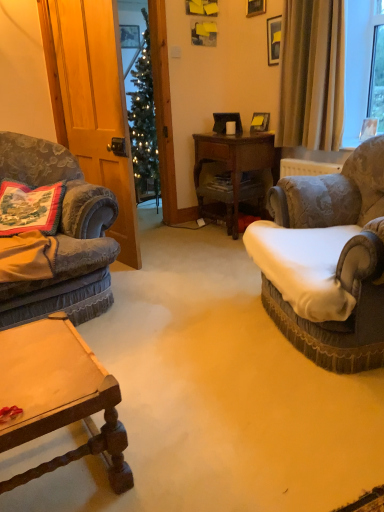
Locate an element on the screen. This screenshot has height=512, width=384. vacant area that is in front of wooden desk at center is located at coordinates (216, 246).